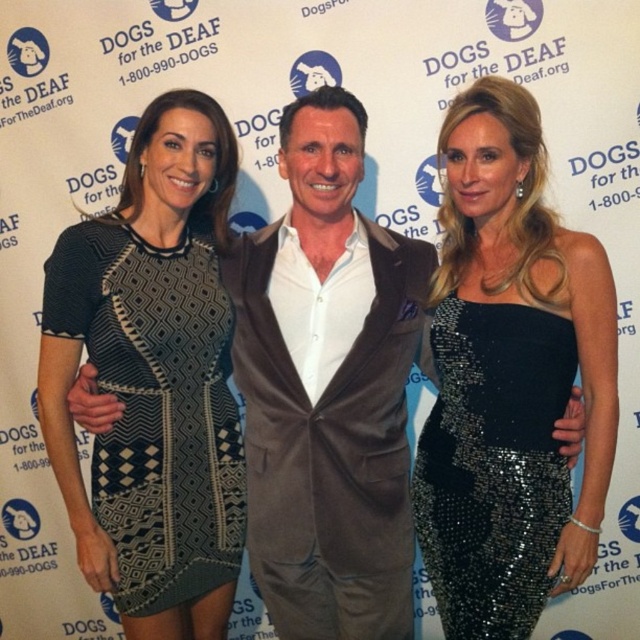
What do you see at coordinates (328, 392) in the screenshot? I see `matte brown suit at center` at bounding box center [328, 392].

Which is below, matte brown suit at center or black textured dress at left?

black textured dress at left is below.

What do you see at coordinates (328, 392) in the screenshot? The height and width of the screenshot is (640, 640). I see `matte brown suit at center` at bounding box center [328, 392].

Image resolution: width=640 pixels, height=640 pixels. In order to click on matte brown suit at center in this screenshot , I will do `click(328, 392)`.

How much distance is there between black textured dress at left and black sequined dress at right?

black textured dress at left and black sequined dress at right are 25.18 inches apart.

From the picture: Is black textured dress at left above black sequined dress at right?

A: Yes.

Measure the distance between point (170,497) and camera.

A distance of 1.85 meters exists between point (170,497) and camera.

Locate an element on the screen. This screenshot has width=640, height=640. black textured dress at left is located at coordinates (156, 404).

Can you confirm if matte brown suit at center is smaller than black sequined dress at right?

Actually, matte brown suit at center might be larger than black sequined dress at right.

Which is behind, point (262, 388) or point (552, 532)?

Positioned behind is point (262, 388).

You are a GUI agent. You are given a task and a screenshot of the screen. Output one action in this format:
    pyautogui.click(x=<x>, y=<y>)
    Task: Click on the matte brown suit at center
    
    Given the screenshot: What is the action you would take?
    pyautogui.click(x=328, y=392)